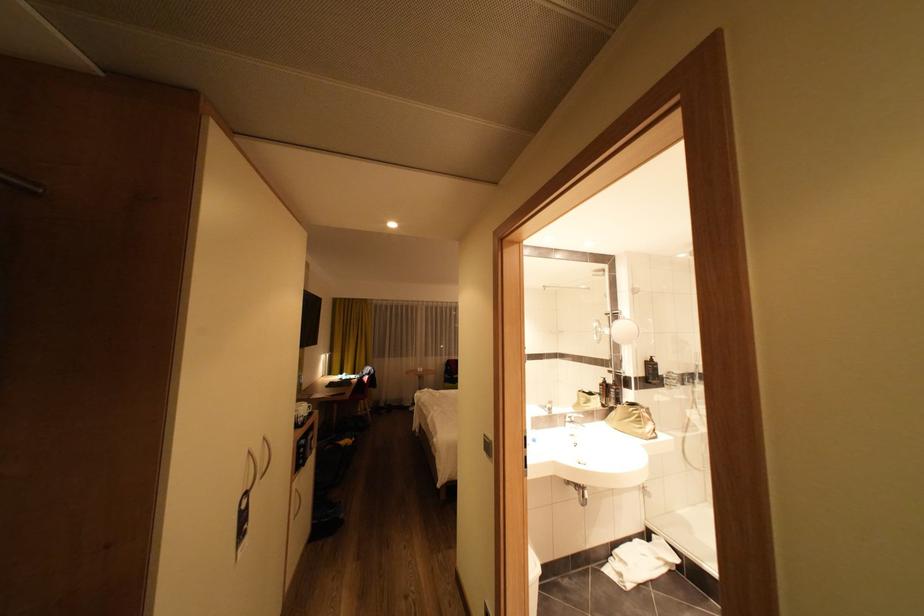
The image size is (924, 616). I want to click on pump bottle dispenser, so click(652, 371).